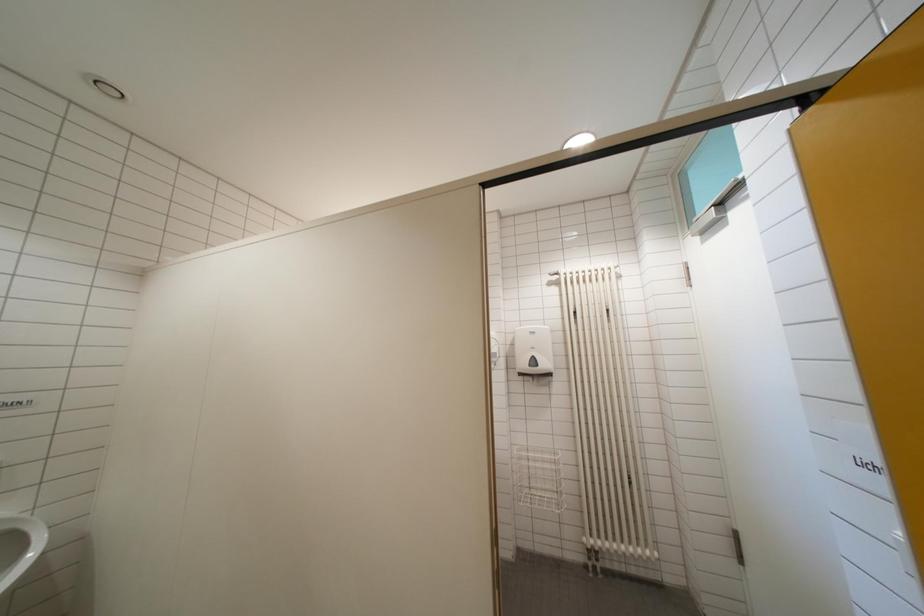
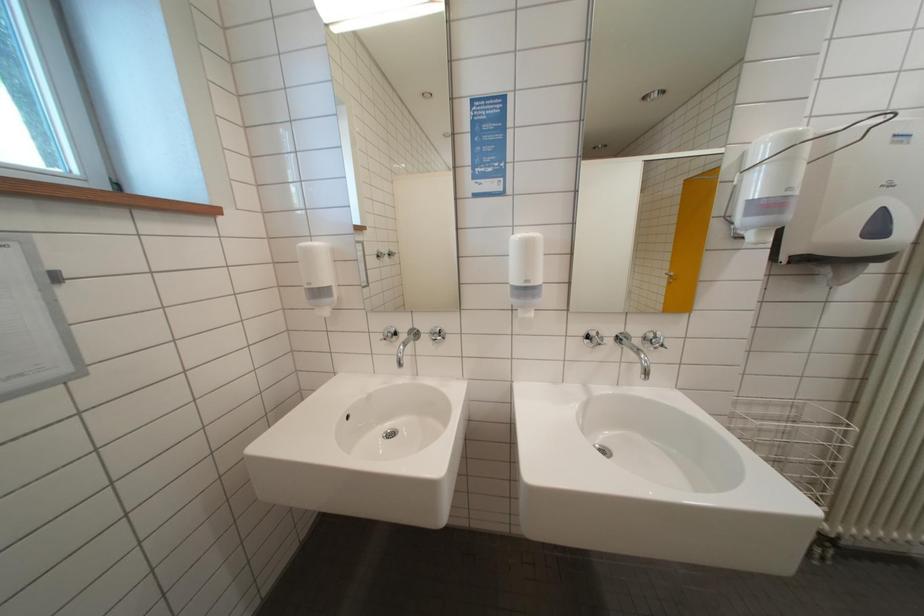
The images are taken continuously from a first-person perspective. In which direction are you moving?

The cameraman moved toward left, forward.